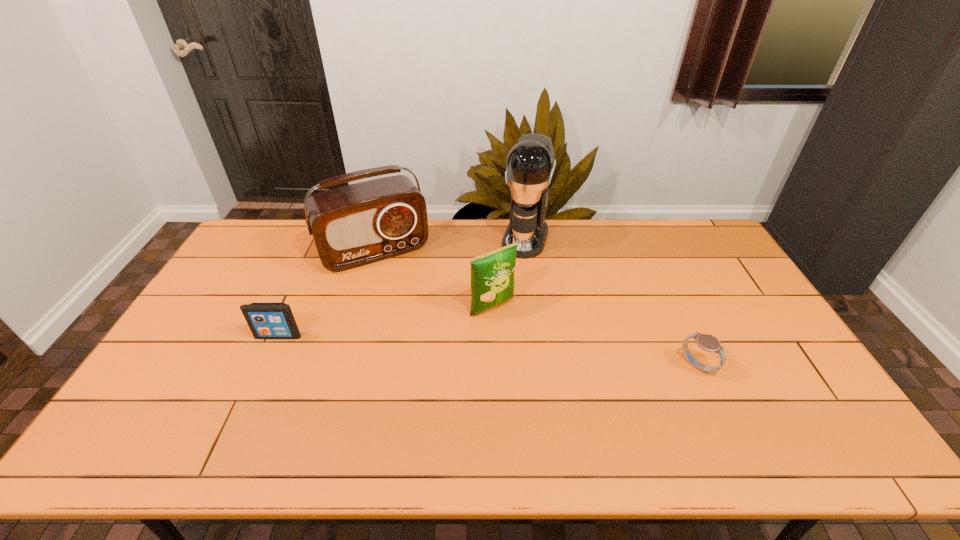
At what (x,y) coordinates should I click in order to perform the action: click on free space in the image that satisfies the following two spatial constraints: 1. on the front side of the watch; 2. on the left side of the third nearest object. Please return your answer as a coordinate pair (x, y). Looking at the image, I should click on coord(494,366).